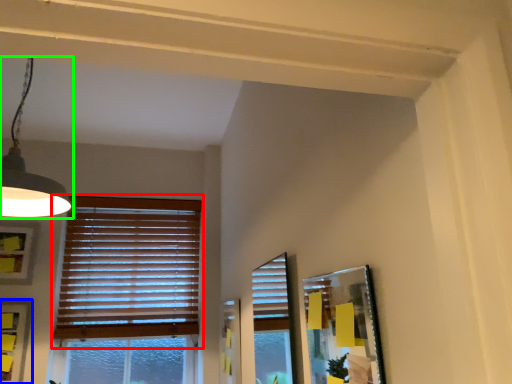
Question: Which object is the farthest from window blind (highlighted by a red box)? Choose among these: picture frame (highlighted by a blue box) or lamp (highlighted by a green box).

Choices:
 (A) picture frame
 (B) lamp

Answer: (B)